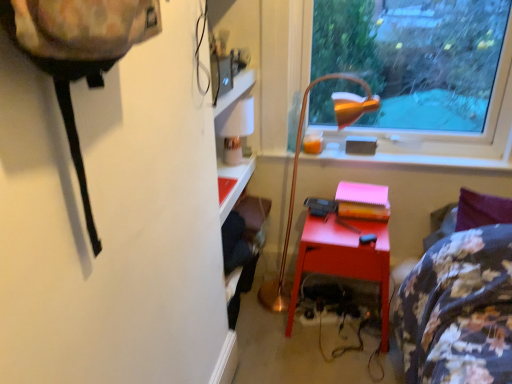
Measure the distance between point [511,153] and camera.

Point [511,153] and camera are 1.88 meters apart.

I want to click on transparent glass window at upper right, so click(423, 67).

Measure the distance between matte red desk at center and camera.

1.73 meters.

Describe the element at coordinates (296, 179) in the screenshot. I see `gold metallic floor lamp at center` at that location.

In order to face gold metallic floor lamp at center, should I rotate leftwards or rightwards?

You should look right and rotate roughly 7.572 degrees.

This screenshot has height=384, width=512. Identify the location of matte orange lampshade at upper center. (409, 160).

Is gold metallic floor lamp at center not near transparent glass window at upper right?

No, gold metallic floor lamp at center is not far away from transparent glass window at upper right.

Considering the points (281, 276) and (473, 45), which point is behind, point (281, 276) or point (473, 45)?

Positioned behind is point (473, 45).

Is gold metallic floor lamp at center taller or shorter than transparent glass window at upper right?

In the image, gold metallic floor lamp at center appears to be taller than transparent glass window at upper right.

In order to click on lamp beneath the transparent glass window at upper right (from a real-world perspective) in this screenshot , I will do `click(296, 179)`.

Based on the photo, which is in front, matte orange lampshade at upper center or transparent glass window at upper right?

transparent glass window at upper right.

Is matte orange lampshade at upper center outside of transparent glass window at upper right?

That's correct, matte orange lampshade at upper center is outside of transparent glass window at upper right.

In the scene shown: From a real-world perspective, between matte orange lampshade at upper center and transparent glass window at upper right, who is vertically lower?

matte orange lampshade at upper center, from a real-world perspective.

From the image's perspective, is matte orange lampshade at upper center under matte red desk at center?

Actually, matte orange lampshade at upper center appears above matte red desk at center in the image.

Is point (498, 161) closer to viewer compared to point (316, 249)?

That is False.

Consider the image. From a real-world perspective, is matte orange lampshade at upper center located beneath matte red desk at center?

No.

What's the angular difference between matte orange lampshade at upper center and matte red desk at center's facing directions?

matte orange lampshade at upper center and matte red desk at center are facing 1.52 degrees away from each other.

Considering the points (382, 252) and (298, 135), which point is in front, point (382, 252) or point (298, 135)?

Point (382, 252)

Can you confirm if matte red desk at center is smaller than gold metallic floor lamp at center?

Indeed, matte red desk at center has a smaller size compared to gold metallic floor lamp at center.

Is matte red desk at center positioned with its back to gold metallic floor lamp at center?

Yes.

Looking at this image, are matte red desk at center and gold metallic floor lamp at center far apart?

That's not correct — matte red desk at center is a little close to gold metallic floor lamp at center.

Locate an element on the screen. The image size is (512, 384). window above the gold metallic floor lamp at center (from a real-world perspective) is located at coordinates (423, 67).

From their relative heights in the image, would you say transparent glass window at upper right is taller or shorter than gold metallic floor lamp at center?

Considering their sizes, transparent glass window at upper right has less height than gold metallic floor lamp at center.

Which is more to the left, transparent glass window at upper right or gold metallic floor lamp at center?

From the viewer's perspective, gold metallic floor lamp at center appears more on the left side.

Consider the image. Is gold metallic floor lamp at center aimed at matte orange lampshade at upper center?

No, gold metallic floor lamp at center is not facing towards matte orange lampshade at upper center.

Is gold metallic floor lamp at center to the right of matte orange lampshade at upper center from the viewer's perspective?

No.

Which object is further away from the camera, gold metallic floor lamp at center or matte orange lampshade at upper center?

matte orange lampshade at upper center.

Considering the relative sizes of gold metallic floor lamp at center and matte orange lampshade at upper center in the image provided, is gold metallic floor lamp at center thinner than matte orange lampshade at upper center?

In fact, gold metallic floor lamp at center might be wider than matte orange lampshade at upper center.

Consider the image. Can you confirm if transparent glass window at upper right is taller than matte red desk at center?

Yes.

Considering the relative sizes of transparent glass window at upper right and matte red desk at center in the image provided, is transparent glass window at upper right bigger than matte red desk at center?

Correct, transparent glass window at upper right is larger in size than matte red desk at center.

Which is correct: transparent glass window at upper right is inside matte red desk at center, or outside of it?

transparent glass window at upper right cannot be found inside matte red desk at center.

Looking at this image, would you say transparent glass window at upper right is to the left or to the right of matte red desk at center in the picture?

transparent glass window at upper right is positioned on matte red desk at center's right side.

Identify the location of lamp below the transparent glass window at upper right (from the image's perspective). (296, 179).

At what (x,y) coordinates should I click in order to perform the action: click on window above the matte orange lampshade at upper center (from the image's perspective). Please return your answer as a coordinate pair (x, y). The height and width of the screenshot is (384, 512). Looking at the image, I should click on (423, 67).

Estimate the real-world distances between objects in this image. Which object is closer to gold metallic floor lamp at center, transparent glass window at upper right or matte red desk at center?

Among the two, matte red desk at center is located nearer to gold metallic floor lamp at center.

Looking at the image, which one is located closer to gold metallic floor lamp at center, matte orange lampshade at upper center or matte red desk at center?

matte orange lampshade at upper center is closer to gold metallic floor lamp at center.

Looking at this image, based on their spatial positions, is matte red desk at center or transparent glass window at upper right further from matte orange lampshade at upper center?

Based on the image, matte red desk at center appears to be further to matte orange lampshade at upper center.

When comparing their distances from transparent glass window at upper right, does matte orange lampshade at upper center or gold metallic floor lamp at center seem closer?

The object closer to transparent glass window at upper right is matte orange lampshade at upper center.

When comparing their distances from transparent glass window at upper right, does gold metallic floor lamp at center or matte orange lampshade at upper center seem further?

Among the two, gold metallic floor lamp at center is located further to transparent glass window at upper right.

Based on their spatial positions, is matte orange lampshade at upper center or gold metallic floor lamp at center closer to matte red desk at center?

The object closer to matte red desk at center is gold metallic floor lamp at center.

Looking at this image, which object lies nearer to the anchor point gold metallic floor lamp at center, matte red desk at center or transparent glass window at upper right?

matte red desk at center is closer to gold metallic floor lamp at center.

Looking at the image, which one is located further to gold metallic floor lamp at center, matte red desk at center or matte orange lampshade at upper center?

matte red desk at center.

Where is `window sill between transparent glass window at upper right and matte red desk at center in the up-down direction`? window sill between transparent glass window at upper right and matte red desk at center in the up-down direction is located at coordinates (409, 160).

At what (x,y) coordinates should I click in order to perform the action: click on window sill between transparent glass window at upper right and gold metallic floor lamp at center from top to bottom. Please return your answer as a coordinate pair (x, y). Looking at the image, I should click on (409, 160).

Identify the location of lamp between transparent glass window at upper right and matte red desk at center vertically. Image resolution: width=512 pixels, height=384 pixels. (296, 179).

The width and height of the screenshot is (512, 384). I want to click on lamp between matte orange lampshade at upper center and matte red desk at center vertically, so click(x=296, y=179).